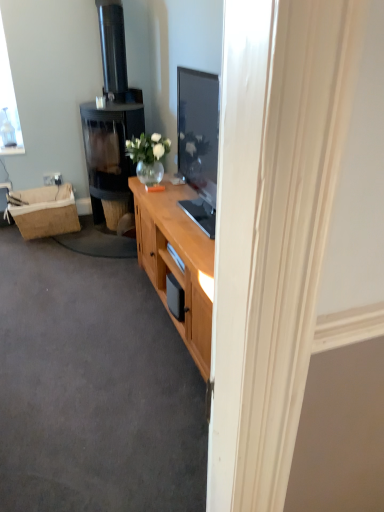
Image resolution: width=384 pixels, height=512 pixels. Identify the location of free space in front of burlap picnic basket at left. click(39, 249).